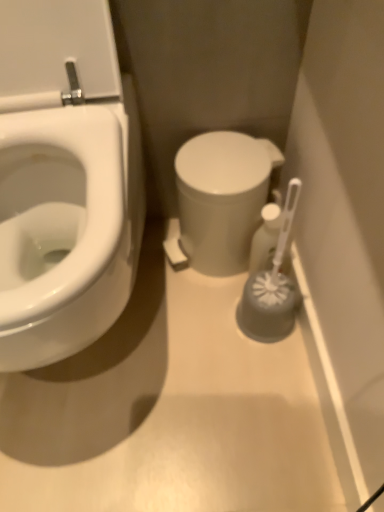
Question: Can you confirm if white glossy toilet at center is positioned to the left of white plastic toilet brush at right?

Choices:
 (A) yes
 (B) no

Answer: (A)

Question: Is white glossy toilet at center not within white plastic toilet brush at right?

Choices:
 (A) no
 (B) yes

Answer: (B)

Question: From a real-world perspective, is white glossy toilet at center below white plastic toilet brush at right?

Choices:
 (A) yes
 (B) no

Answer: (B)

Question: From a real-world perspective, is white glossy toilet at center over white plastic toilet brush at right?

Choices:
 (A) yes
 (B) no

Answer: (A)

Question: Can you confirm if white glossy toilet at center is shorter than white plastic toilet brush at right?

Choices:
 (A) no
 (B) yes

Answer: (A)

Question: Considering the relative sizes of white glossy toilet at center and white plastic toilet brush at right in the image provided, is white glossy toilet at center thinner than white plastic toilet brush at right?

Choices:
 (A) no
 (B) yes

Answer: (A)

Question: From the image's perspective, would you say white plastic toilet brush at right is positioned over white glossy toilet at center?

Choices:
 (A) yes
 (B) no

Answer: (B)

Question: Does white plastic toilet brush at right contain white glossy toilet at center?

Choices:
 (A) no
 (B) yes

Answer: (A)

Question: Does white plastic toilet brush at right appear on the left side of white glossy toilet at center?

Choices:
 (A) yes
 (B) no

Answer: (B)

Question: Does white plastic toilet brush at right lie behind white glossy toilet at center?

Choices:
 (A) yes
 (B) no

Answer: (A)

Question: From a real-world perspective, is white plastic toilet brush at right physically below white glossy toilet at center?

Choices:
 (A) no
 (B) yes

Answer: (B)

Question: From the image's perspective, is white plastic toilet brush at right beneath white glossy toilet at center?

Choices:
 (A) yes
 (B) no

Answer: (A)

Question: Does white plastic toilet brush at right have a smaller size compared to white glossy bidet at left?

Choices:
 (A) no
 (B) yes

Answer: (B)